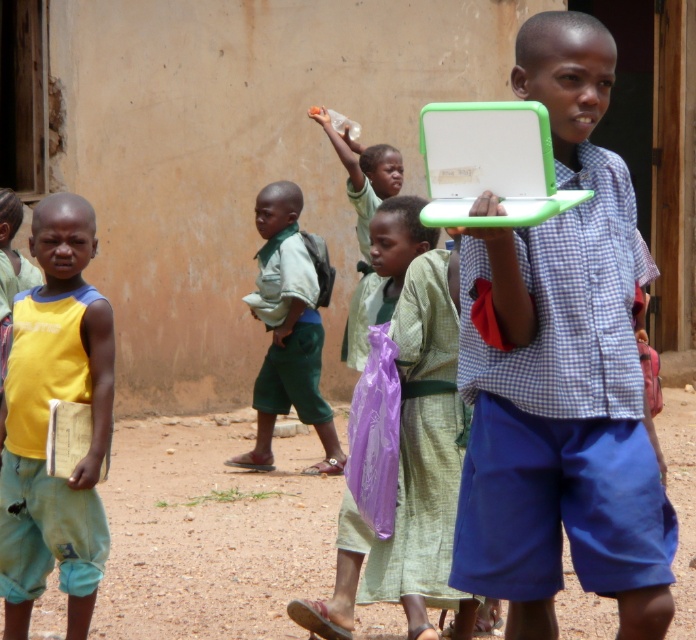
Does yellow fabric shirt at left appear on the left side of green fabric shirt at center?

Indeed, yellow fabric shirt at left is positioned on the left side of green fabric shirt at center.

Which is in front, point (106, 532) or point (292, 385)?

Positioned in front is point (106, 532).

Find the location of a particular element. The width and height of the screenshot is (696, 640). yellow fabric shirt at left is located at coordinates (47, 422).

Who is higher up, matte green laptop at center or green plastic laptop at center?

Positioned higher is green plastic laptop at center.

Is point (544, 536) closer to camera compared to point (461, 112)?

No, (544, 536) is behind (461, 112).

Where is `matte green laptop at center`? matte green laptop at center is located at coordinates (561, 372).

At what (x,y) coordinates should I click in order to perform the action: click on matte green laptop at center. Please return your answer as a coordinate pair (x, y). Image resolution: width=696 pixels, height=640 pixels. Looking at the image, I should click on (561, 372).

Which of these two, matte green laptop at center or yellow fabric shirt at left, stands shorter?

Standing shorter between the two is yellow fabric shirt at left.

Does matte green laptop at center appear on the left side of yellow fabric shirt at left?

No, matte green laptop at center is not to the left of yellow fabric shirt at left.

Is point (571, 378) more distant than point (79, 618)?

No, (571, 378) is in front of (79, 618).

Image resolution: width=696 pixels, height=640 pixels. I want to click on matte green laptop at center, so click(561, 372).